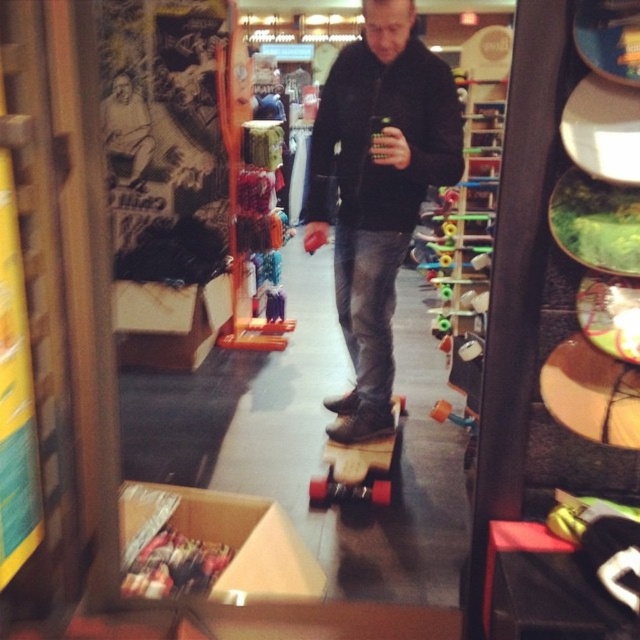
You are a customer in the skate shop and want to purchase both the black leather jacket at center and the wooden deck skateboard at center. However, you have a storage box that can only accommodate items up to the size of the skateboard. Can you fit both items into the box?

The black leather jacket at center is wider than the wooden deck skateboard at center. Since the storage box can only hold items up to the skateboard size, the jacket won

You are a customer in the skate shop and want to place a new order. You need to place a small sticker exactly at the center of the wooden skateboard at center. According to the shop layout, where should you place the sticker?

The wooden skateboard at center is located at point (378, 189), so you should place the sticker at those coordinates to center it.